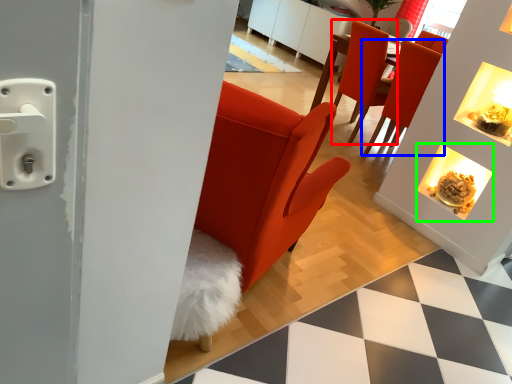
Question: Which object is positioned closest to chair (highlighted by a red box)? Select from chair (highlighted by a blue box) and fireplace (highlighted by a green box).

Choices:
 (A) chair
 (B) fireplace

Answer: (A)